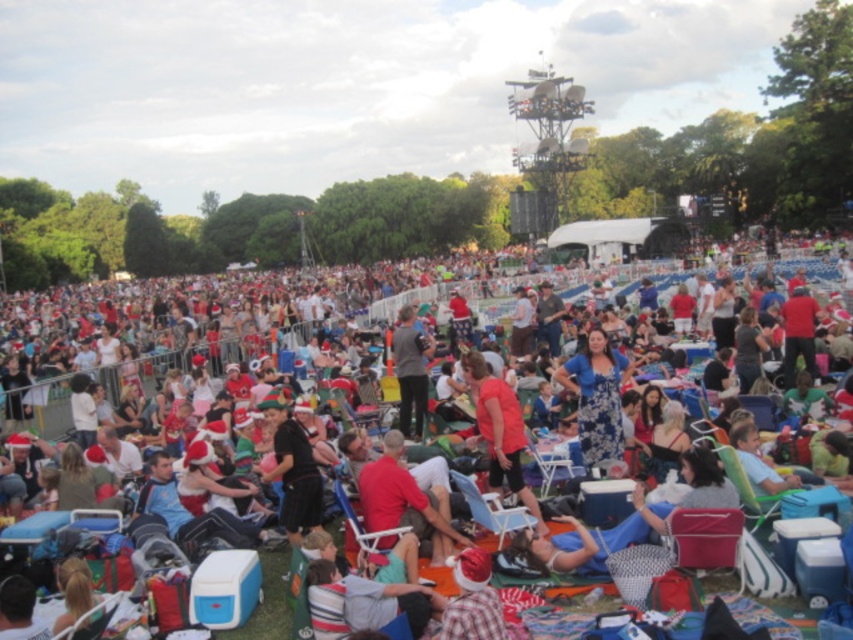
You are organizing a photo shoot and need to ensure that both the matte red santa hat at center and the blue plastic chair at center are visible in the frame. Given their sizes, which object might require more space in the foreground to be fully captured?

The matte red santa hat at center is bigger than the blue plastic chair at center, so it would require more space in the foreground to be fully captured.

Consider the image. You are at the event and want to find someone wearing a red shirt at center. What are the coordinates where you should look?

The red shirt at center is located at coordinates point (405, 500).

You are a photographer at the event and want to capture a photo of the black matte shirt at center without the blue plastic chair at center appearing in the foreground. Is this possible based on their positions?

The black matte shirt at center is located above the blue plastic chair at center, so yes, the photographer can capture the black matte shirt at center without the blue plastic chair at center in the foreground by adjusting the angle to focus on the upper part where the shirt is positioned.